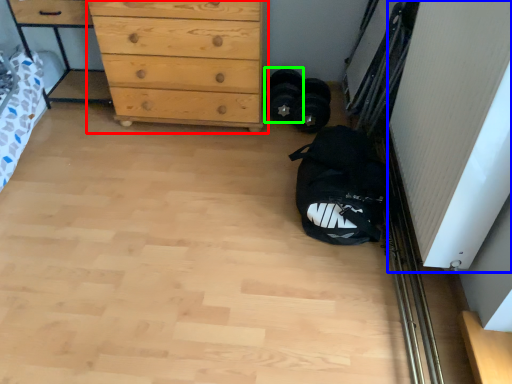
Question: Based on their relative distances, which object is farther from chest of drawers (highlighted by a red box)? Choose from screen door (highlighted by a blue box) and footwear (highlighted by a green box).

Choices:
 (A) screen door
 (B) footwear

Answer: (A)